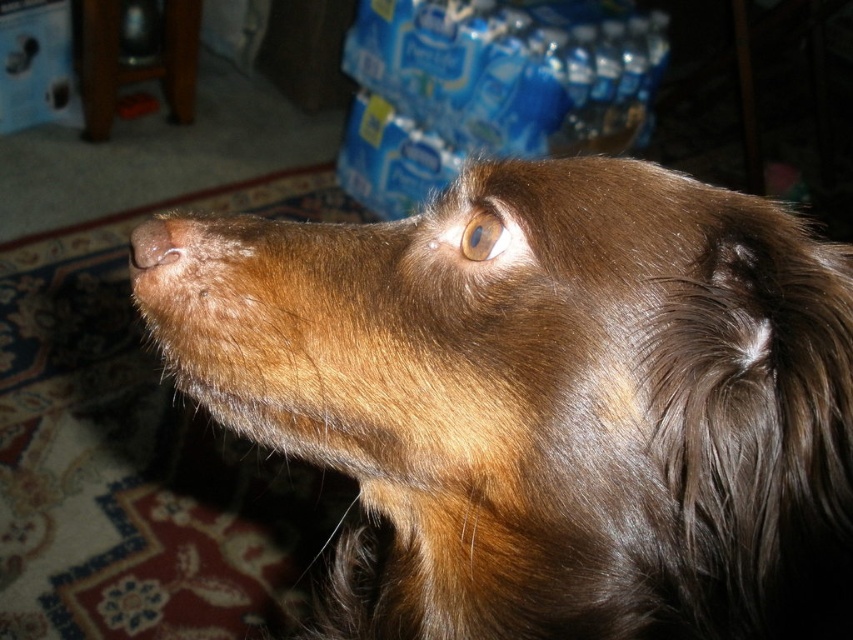
Locate an element on the screen. The width and height of the screenshot is (853, 640). shiny brown fur at upper center is located at coordinates pos(544,401).

Which is behind, point (492, 230) or point (146, 262)?

Point (146, 262)

Is brown glossy eye at upper center to the left of brown fur at center from the viewer's perspective?

Incorrect, brown glossy eye at upper center is not on the left side of brown fur at center.

Which is behind, point (480, 259) or point (166, 228)?

Point (166, 228)

Locate an element on the screen. Image resolution: width=853 pixels, height=640 pixels. brown glossy eye at upper center is located at coordinates (483, 236).

Can you confirm if shiny brown fur at upper center is wider than brown glossy eye at upper center?

Yes, shiny brown fur at upper center is wider than brown glossy eye at upper center.

Does shiny brown fur at upper center appear on the right side of brown glossy eye at upper center?

Incorrect, shiny brown fur at upper center is not on the right side of brown glossy eye at upper center.

Where is `shiny brown fur at upper center`? The image size is (853, 640). shiny brown fur at upper center is located at coordinates (544, 401).

Where is `shiny brown fur at upper center`? shiny brown fur at upper center is located at coordinates (544, 401).